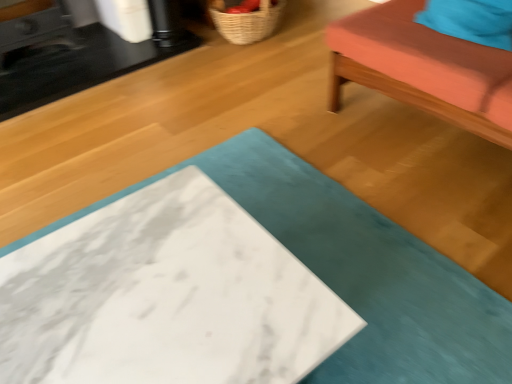
Question: Is woven straw basket at upper center further to the viewer compared to black marble table at upper left, which is the 1th table from back to front?

Choices:
 (A) no
 (B) yes

Answer: (B)

Question: From a real-world perspective, is woven straw basket at upper center on top of black marble table at upper left, which ranks as the second table in bottom-to-top order?

Choices:
 (A) yes
 (B) no

Answer: (A)

Question: From the image's perspective, is woven straw basket at upper center under black marble table at upper left, which ranks as the second table in bottom-to-top order?

Choices:
 (A) no
 (B) yes

Answer: (A)

Question: Considering the relative sizes of woven straw basket at upper center and black marble table at upper left, which ranks as the second table in bottom-to-top order, in the image provided, is woven straw basket at upper center thinner than black marble table at upper left, which ranks as the second table in bottom-to-top order,?

Choices:
 (A) yes
 (B) no

Answer: (A)

Question: Is the depth of woven straw basket at upper center less than that of black marble table at upper left, which is the 1th table from back to front?

Choices:
 (A) no
 (B) yes

Answer: (A)

Question: Is woven straw basket at upper center facing away from black marble table at upper left, the 1th table positioned from the top?

Choices:
 (A) no
 (B) yes

Answer: (A)

Question: Is black marble table at upper left, the 1th table positioned from the top, not near teal fabric pillow at upper right?

Choices:
 (A) no
 (B) yes

Answer: (B)

Question: Does black marble table at upper left, the 1th table positioned from the top, have a lesser width compared to teal fabric pillow at upper right?

Choices:
 (A) no
 (B) yes

Answer: (A)

Question: Is black marble table at upper left, which is the 1th table from back to front, outside teal fabric pillow at upper right?

Choices:
 (A) no
 (B) yes

Answer: (B)

Question: From a real-world perspective, is black marble table at upper left, which is the 1th table from back to front, located higher than teal fabric pillow at upper right?

Choices:
 (A) yes
 (B) no

Answer: (B)

Question: Does black marble table at upper left, which is the 1th table from back to front, have a lesser height compared to teal fabric pillow at upper right?

Choices:
 (A) no
 (B) yes

Answer: (B)

Question: Is black marble table at upper left, the 1th table positioned from the top, looking in the opposite direction of teal fabric pillow at upper right?

Choices:
 (A) no
 (B) yes

Answer: (A)

Question: Can you confirm if teal fabric cushion at upper right is bigger than black marble table at upper left, the second table from the front?

Choices:
 (A) yes
 (B) no

Answer: (A)